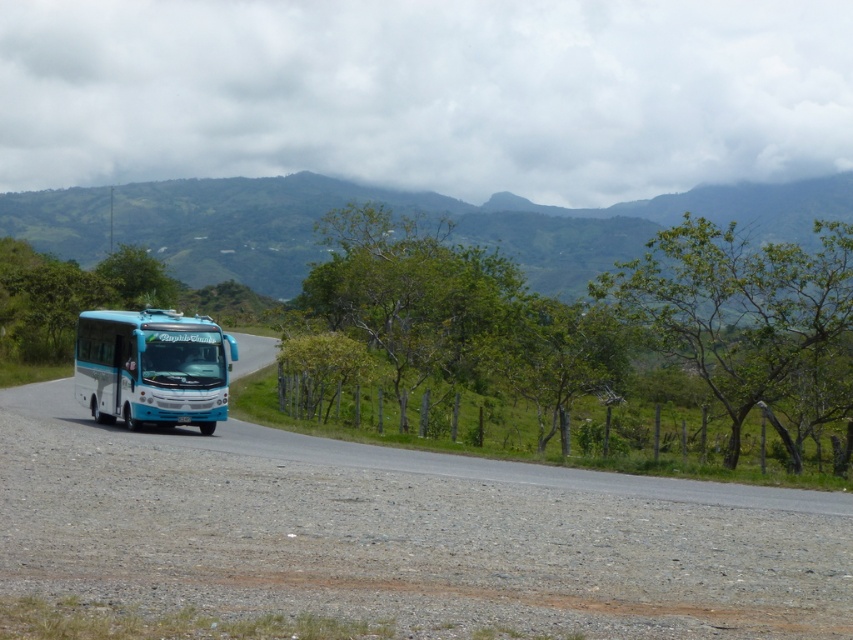
Consider the image. Does green leafy mountain at upper center appear under teal glossy bus at left?

Actually, green leafy mountain at upper center is above teal glossy bus at left.

Can you confirm if green leafy mountain at upper center is thinner than teal glossy bus at left?

In fact, green leafy mountain at upper center might be wider than teal glossy bus at left.

Is point (769, 193) farther from viewer compared to point (186, 323)?

Yes, point (769, 193) is farther from viewer.

This screenshot has height=640, width=853. I want to click on green leafy mountain at upper center, so click(x=436, y=218).